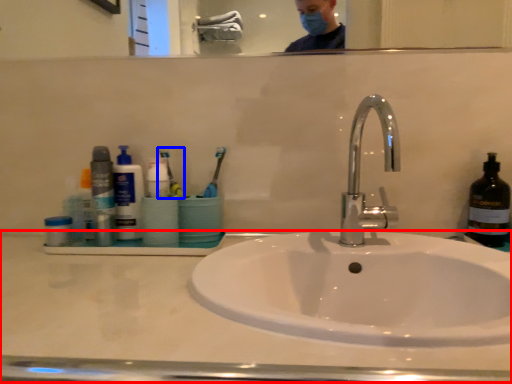
Question: Which object is further to the camera taking this photo, counter top (highlighted by a red box) or toothbrush (highlighted by a blue box)?

Choices:
 (A) counter top
 (B) toothbrush

Answer: (B)